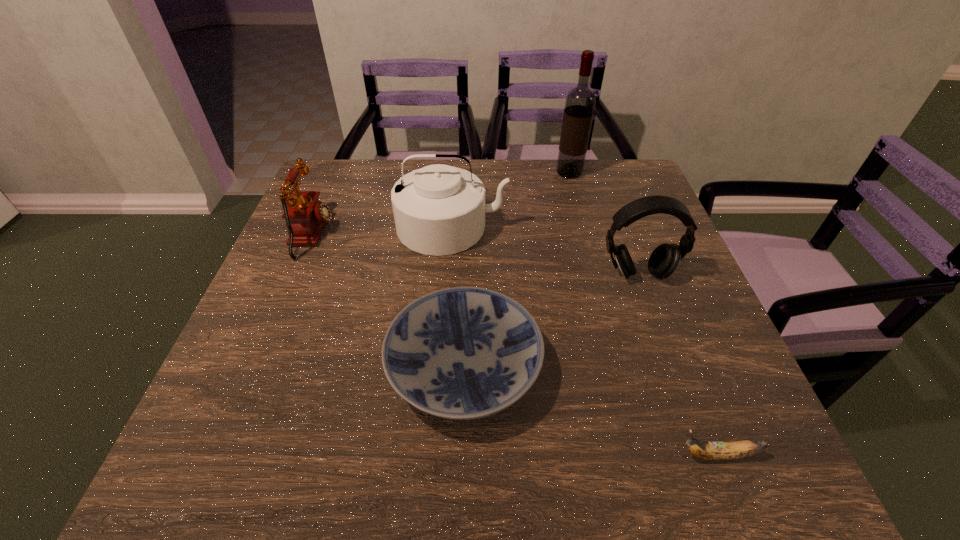
Find the location of a particular element. This screenshot has width=960, height=540. vacant area that lies between the kettle and the leftmost object is located at coordinates (383, 231).

Where is `free space that is in between the plate and the nearest object`? Image resolution: width=960 pixels, height=540 pixels. free space that is in between the plate and the nearest object is located at coordinates (590, 410).

Find the location of a particular element. This screenshot has width=960, height=540. free space between the plate and the tallest object is located at coordinates (516, 269).

Locate an element on the screen. This screenshot has height=540, width=960. vacant area that lies between the banana and the kettle is located at coordinates (585, 341).

Locate an element on the screen. The height and width of the screenshot is (540, 960). vacant area that lies between the earphone and the second nearest object is located at coordinates (551, 321).

In order to click on empty space that is in between the kettle and the wine bottle in this screenshot , I will do `click(511, 200)`.

Image resolution: width=960 pixels, height=540 pixels. I want to click on vacant region between the third nearest object and the kettle, so click(x=544, y=251).

Find the location of `free space that is in between the kettle and the tallest object`. free space that is in between the kettle and the tallest object is located at coordinates (511, 200).

Where is `the second closest object to the plate`? The width and height of the screenshot is (960, 540). the second closest object to the plate is located at coordinates (664, 260).

Select which object is the fourth closest to the earphone. Please provide its 2D coordinates. Your answer should be formatted as a tuple, i.e. [(x, y)], where the tuple contains the x and y coordinates of a point satisfying the conditions above.

[(738, 449)]